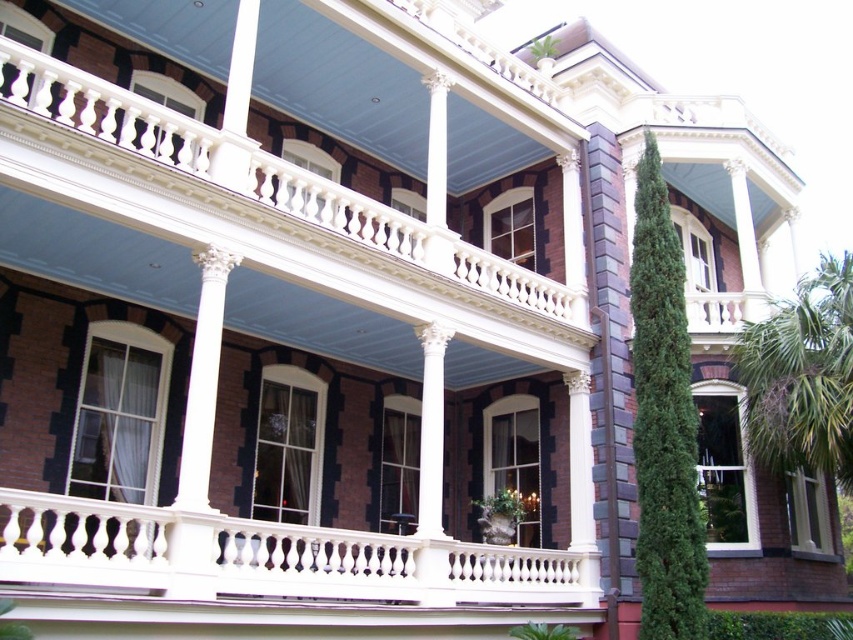
Question: Which of the following is the farthest from the observer?

Choices:
 (A) green textured cypress tree at right
 (B) white polished wood balustrade at center
 (C) white marble column at center
 (D) green leafy palm at right

Answer: (D)

Question: Does green textured cypress tree at right lie behind green leafy palm at right?

Choices:
 (A) no
 (B) yes

Answer: (A)

Question: Which object is the closest to the white marble column at center?

Choices:
 (A) green leafy palm at right
 (B) green textured cypress tree at right
 (C) white polished wood balustrade at center

Answer: (C)

Question: Is white polished wood balustrade at center to the left of white marble column at center from the viewer's perspective?

Choices:
 (A) yes
 (B) no

Answer: (B)

Question: From the image, what is the correct spatial relationship of white polished wood balustrade at center in relation to white marble column at center?

Choices:
 (A) left
 (B) right

Answer: (B)

Question: Based on their relative distances, which object is nearer to the green textured cypress tree at right?

Choices:
 (A) white polished wood balustrade at center
 (B) green leafy palm at right
 (C) white marble column at center

Answer: (B)